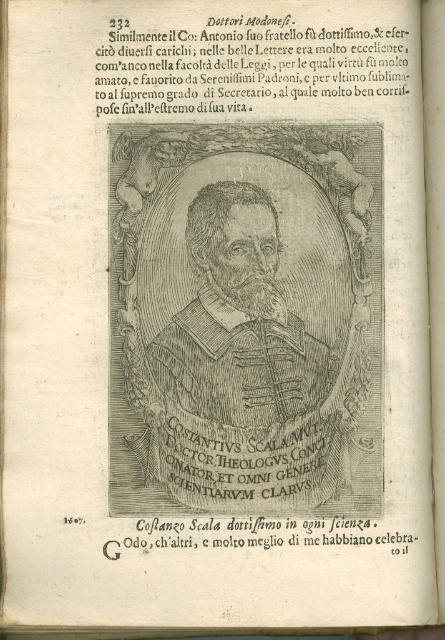
Is black engraving portrait at center taller than black paper text at upper center?

Yes, black engraving portrait at center is taller than black paper text at upper center.

Looking at this image, does black engraving portrait at center appear on the left side of black paper text at upper center?

Correct, you'll find black engraving portrait at center to the left of black paper text at upper center.

Which is in front, point (207, 288) or point (379, 58)?

Positioned in front is point (207, 288).

The image size is (445, 640). I want to click on black engraving portrait at center, so click(243, 312).

Between black paper text at upper center and black paper at lower center, which one has less height?

black paper at lower center is shorter.

I want to click on black paper text at upper center, so click(249, 61).

Between point (125, 376) and point (365, 538), which one is positioned in front?

Point (125, 376) is in front.

Who is taller, black engraving portrait at center or black paper at lower center?

Standing taller between the two is black engraving portrait at center.

Locate an element on the screen. The image size is (445, 640). black engraving portrait at center is located at coordinates (243, 312).

Image resolution: width=445 pixels, height=640 pixels. Find the location of `black engraving portrait at center`. black engraving portrait at center is located at coordinates (243, 312).